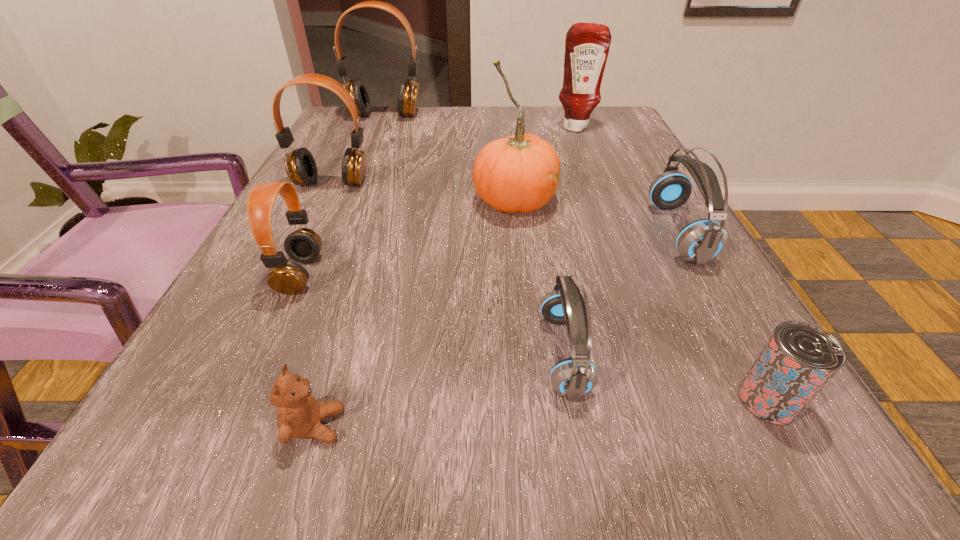
Locate an element on the screen. The height and width of the screenshot is (540, 960). free spot at the far left corner of the desktop is located at coordinates (393, 106).

Identify the location of vacant area at the near left corner. Image resolution: width=960 pixels, height=540 pixels. (171, 513).

Locate an element on the screen. free space at the near right corner is located at coordinates (817, 515).

Where is `vacant space in between the bigger blue headset and the beer can`? The image size is (960, 540). vacant space in between the bigger blue headset and the beer can is located at coordinates (723, 316).

The width and height of the screenshot is (960, 540). Find the location of `vacant region between the farthest headset and the teddy bear`. vacant region between the farthest headset and the teddy bear is located at coordinates pyautogui.click(x=350, y=271).

Locate an element on the screen. free space between the biggest brown headset and the nearest headset is located at coordinates (474, 235).

Image resolution: width=960 pixels, height=540 pixels. In order to click on free space between the tallest headset and the red beer can in this screenshot , I will do `click(577, 258)`.

The height and width of the screenshot is (540, 960). I want to click on blank region between the nearer blue headset and the third object from right to left, so click(569, 241).

Locate an element on the screen. This screenshot has width=960, height=540. free space between the farther blue headset and the red beer can is located at coordinates (723, 316).

Where is `vacant space in between the brown teddy bear and the seventh object from left to right`? vacant space in between the brown teddy bear and the seventh object from left to right is located at coordinates (445, 276).